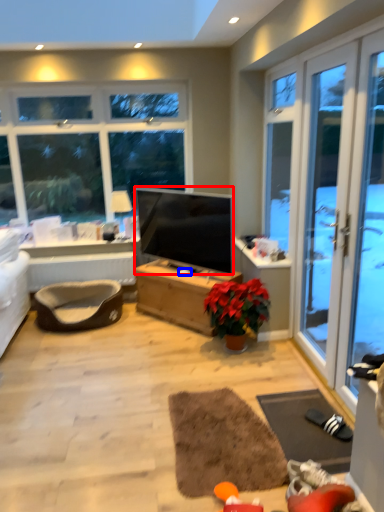
Question: Which object is closer to the camera taking this photo, television (highlighted by a red box) or loudspeaker (highlighted by a blue box)?

Choices:
 (A) television
 (B) loudspeaker

Answer: (A)